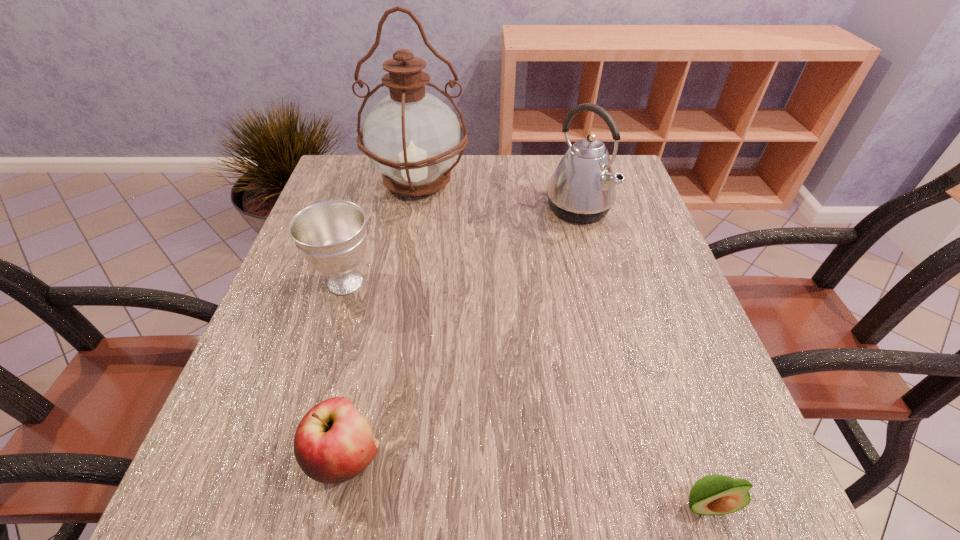
Find the location of a particular element. The height and width of the screenshot is (540, 960). free space between the avocado and the oil lamp is located at coordinates (562, 343).

Locate an element on the screen. The image size is (960, 540). empty space that is in between the third shortest object and the kettle is located at coordinates (462, 245).

Locate an element on the screen. The width and height of the screenshot is (960, 540). vacant region between the apple and the chalice is located at coordinates (346, 369).

Find the location of a particular element. free space between the second tallest object and the third tallest object is located at coordinates (462, 245).

At what (x,y) coordinates should I click in order to perform the action: click on free space between the tallest object and the second tallest object. Please return your answer as a coordinate pair (x, y). The width and height of the screenshot is (960, 540). Looking at the image, I should click on (x=498, y=195).

The image size is (960, 540). I want to click on free space between the apple and the oil lamp, so click(x=382, y=319).

Identify the location of free point between the avocado and the second tallest object. (642, 357).

Find the location of a particular element. empty space between the chalice and the second tallest object is located at coordinates [462, 245].

Identify the location of vacant point located between the avocado and the second tallest object. (642, 357).

The height and width of the screenshot is (540, 960). Identify the location of free space between the apple and the fourth shortest object. 462,333.